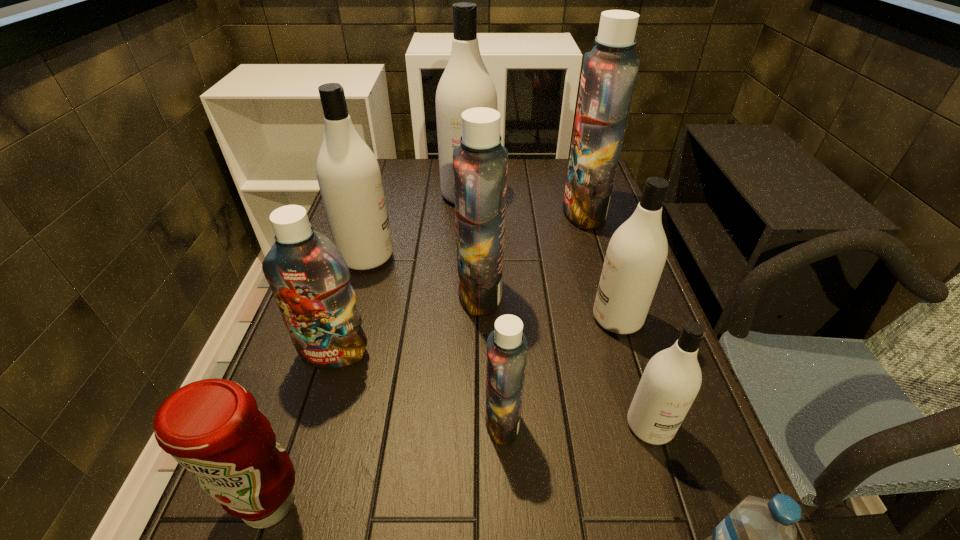
The image size is (960, 540). In order to click on vacant area that lies between the farthest white shampoo and the second biggest white shampoo in this screenshot , I will do `click(418, 226)`.

Identify the location of unoccupied area between the third biggest white shampoo and the second farthest blue shampoo. (549, 306).

Point out which object is positioned as the fourth nearest to the nearest white shampoo. Please provide its 2D coordinates. Your answer should be formatted as a tuple, i.e. [(x, y)], where the tuple contains the x and y coordinates of a point satisfying the conditions above.

[(480, 163)]

The image size is (960, 540). Identify the location of object that stands as the third closest to the farthest blue shampoo. [636, 254].

Select which shampoo is the sixth closest to the sixth farthest object. Please provide its 2D coordinates. Your answer should be formatted as a tuple, i.e. [(x, y)], where the tuple contains the x and y coordinates of a point satisfying the conditions above.

[(465, 84)]

Where is `the fifth closest shampoo relative to the fifth nearest object`? Image resolution: width=960 pixels, height=540 pixels. the fifth closest shampoo relative to the fifth nearest object is located at coordinates (672, 378).

I want to click on blue shampoo that is the third closest to the third biggest blue shampoo, so click(x=610, y=69).

You are a GUI agent. You are given a task and a screenshot of the screen. Output one action in this format:
    pyautogui.click(x=<x>, y=<y>)
    Task: Click on the blue shampoo that is the second nearest to the third nearest blue shampoo
    
    Given the screenshot: What is the action you would take?
    pyautogui.click(x=507, y=348)

Select which white shampoo appears as the third closest to the water bottle. Please provide its 2D coordinates. Your answer should be formatted as a tuple, i.e. [(x, y)], where the tuple contains the x and y coordinates of a point satisfying the conditions above.

[(349, 177)]

This screenshot has height=540, width=960. What are the coordinates of `white shampoo that is the closest one to the third smallest white shampoo` in the screenshot? It's located at (465, 84).